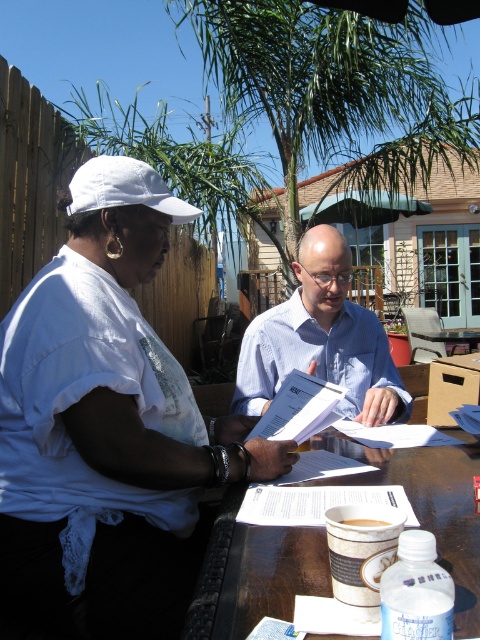
Does point (11, 568) come in front of point (144, 179)?

Yes, point (11, 568) is closer to viewer.

The height and width of the screenshot is (640, 480). What are the coordinates of `white cotton shirt at upper left` in the screenshot? It's located at (108, 426).

Does blue shirt at center appear under white fabric baseball cap at upper left?

Yes.

Does point (373, 358) come behind point (134, 195)?

Yes, it is.

What are the coordinates of `blue shirt at center` in the screenshot? It's located at (322, 339).

Locate an element on the screen. The width and height of the screenshot is (480, 640). blue shirt at center is located at coordinates (322, 339).

Is white cotton shirt at upper left thinner than brown matte cup at center?

No, white cotton shirt at upper left is not thinner than brown matte cup at center.

Is white cotton shirt at upper left to the right of brown matte cup at center from the viewer's perspective?

In fact, white cotton shirt at upper left is to the left of brown matte cup at center.

Is point (25, 481) closer to camera compared to point (362, 525)?

No, (25, 481) is behind (362, 525).

Where is `white cotton shirt at upper left`? The width and height of the screenshot is (480, 640). white cotton shirt at upper left is located at coordinates (108, 426).